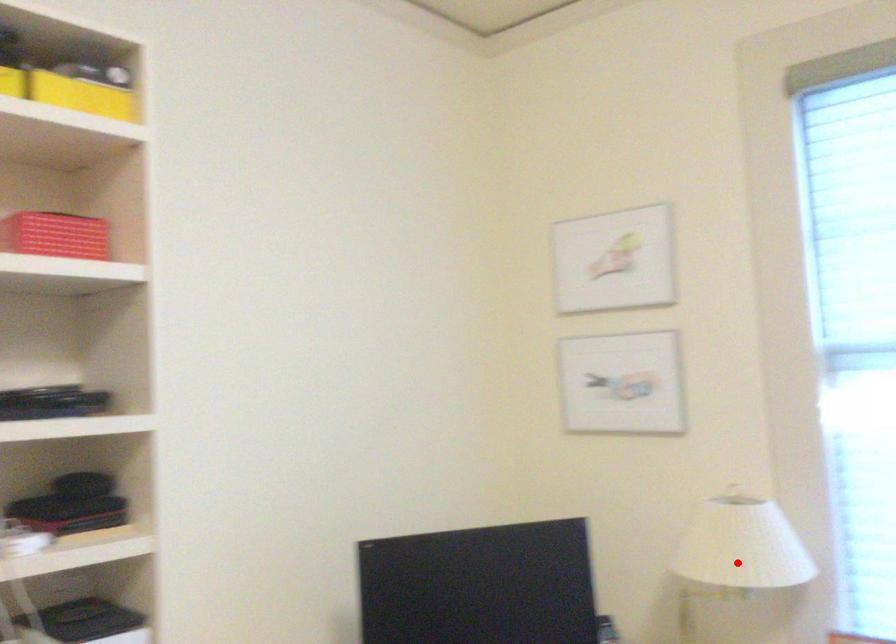
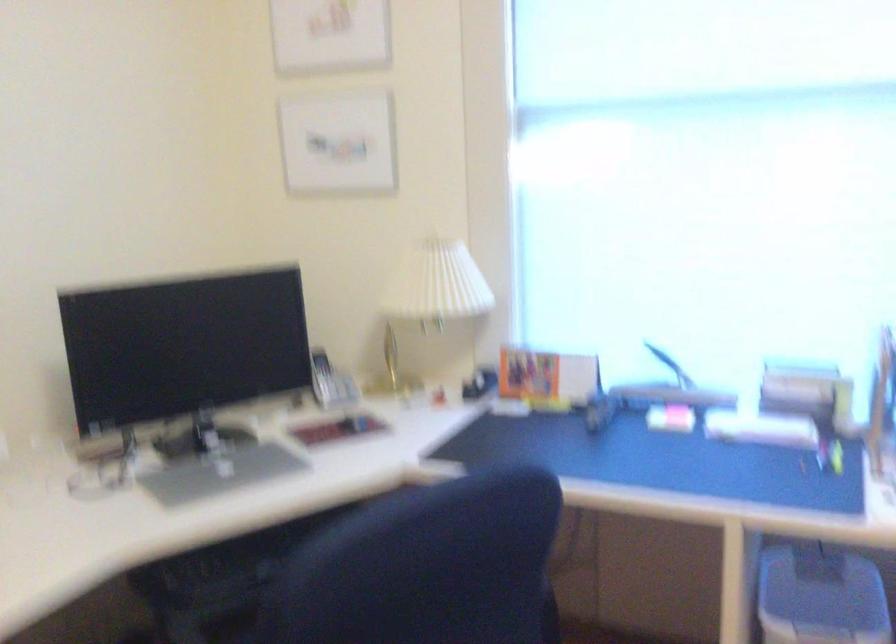
Locate, in the second image, the point that corresponds to the highlighted location in the first image.

(433, 295)